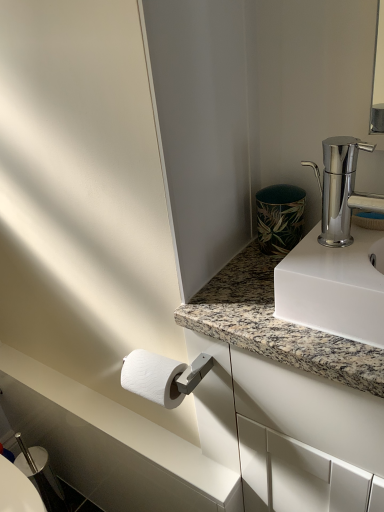
At what (x,y) coordinates should I click in order to perform the action: click on free space above granite at upper right (from a real-world perspective). Please return your answer as a coordinate pair (x, y). Image resolution: width=384 pixels, height=512 pixels. Looking at the image, I should click on (272, 301).